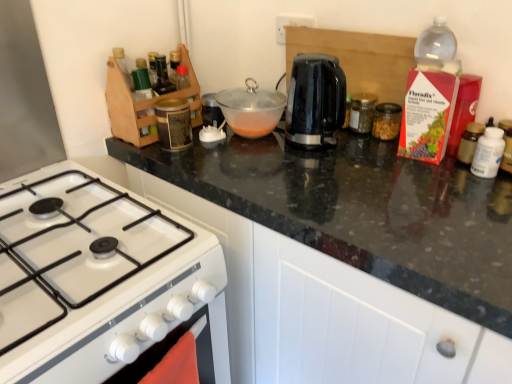
The image size is (512, 384). In order to click on free spot in front of clear glass jar at center, which ranks as the 3th kitchen appliance in left-to-right order in this screenshot , I will do `click(368, 152)`.